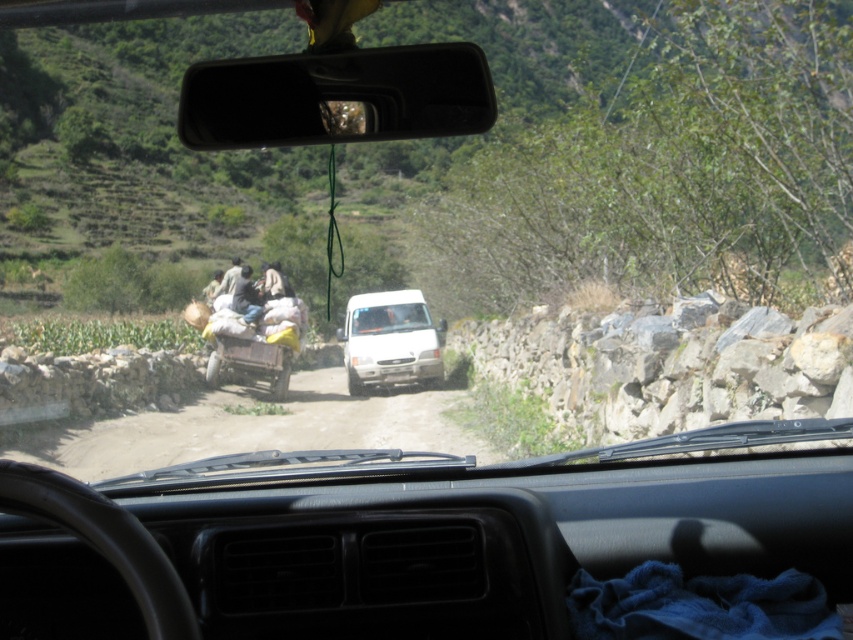
Question: From the image, what is the correct spatial relationship of white matte van at center in relation to clear glass windshield at center?

Choices:
 (A) right
 (B) left

Answer: (A)

Question: Can you confirm if white matte van at center is smaller than clear glass windshield at center?

Choices:
 (A) yes
 (B) no

Answer: (B)

Question: Which object is positioned closest to the white matte van at center?

Choices:
 (A) dark gray fabric bag at center
 (B) clear glass windshield at center
 (C) black plastic view mirror at center
 (D) dusty gravel road at center

Answer: (B)

Question: Which point appears farthest from the camera in this image?

Choices:
 (A) (479, 54)
 (B) (376, 305)
 (C) (245, 300)

Answer: (B)

Question: Which point is closer to the camera?

Choices:
 (A) white matte van at center
 (B) dark gray fabric bag at center
 (C) black plastic view mirror at center

Answer: (C)

Question: Where is dusty gravel road at center located in relation to white matte van at center in the image?

Choices:
 (A) right
 (B) left

Answer: (B)